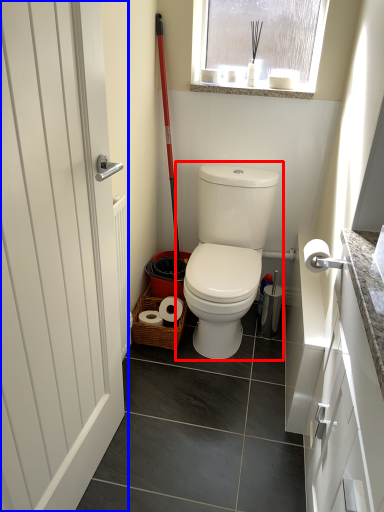
Question: Which object appears farthest to the camera in this image, toilet (highlighted by a red box) or door (highlighted by a blue box)?

Choices:
 (A) toilet
 (B) door

Answer: (A)